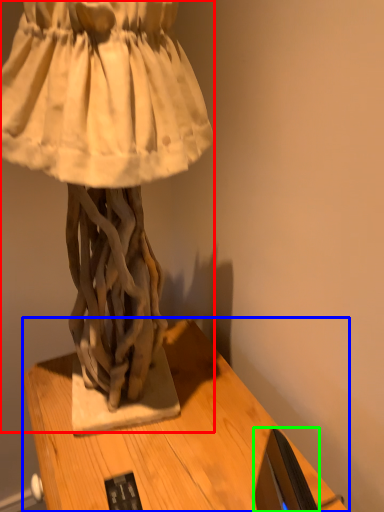
Question: Estimate the real-world distances between objects in this image. Which object is farther from sculpture (highlighted by a red box), table (highlighted by a blue box) or computer monitor (highlighted by a green box)?

Choices:
 (A) table
 (B) computer monitor

Answer: (B)